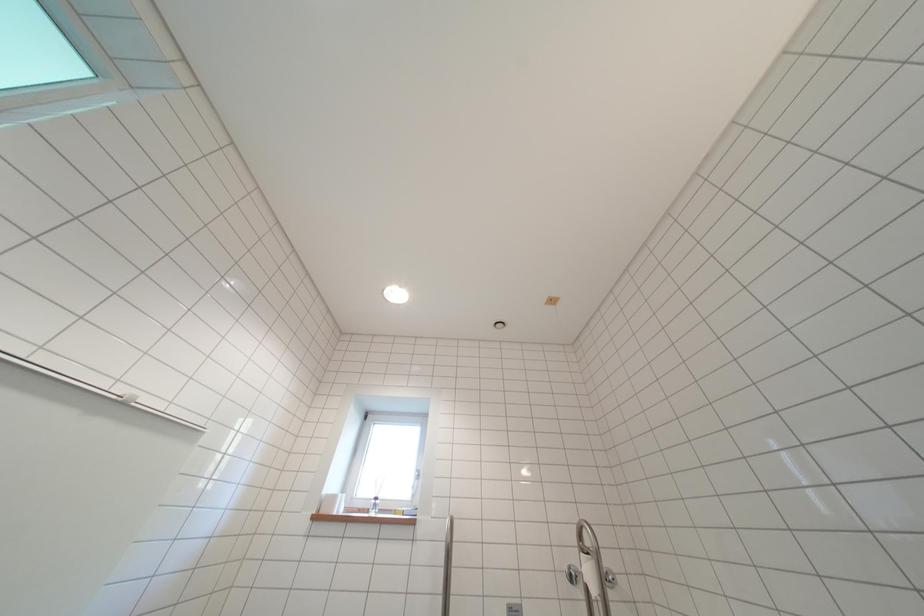
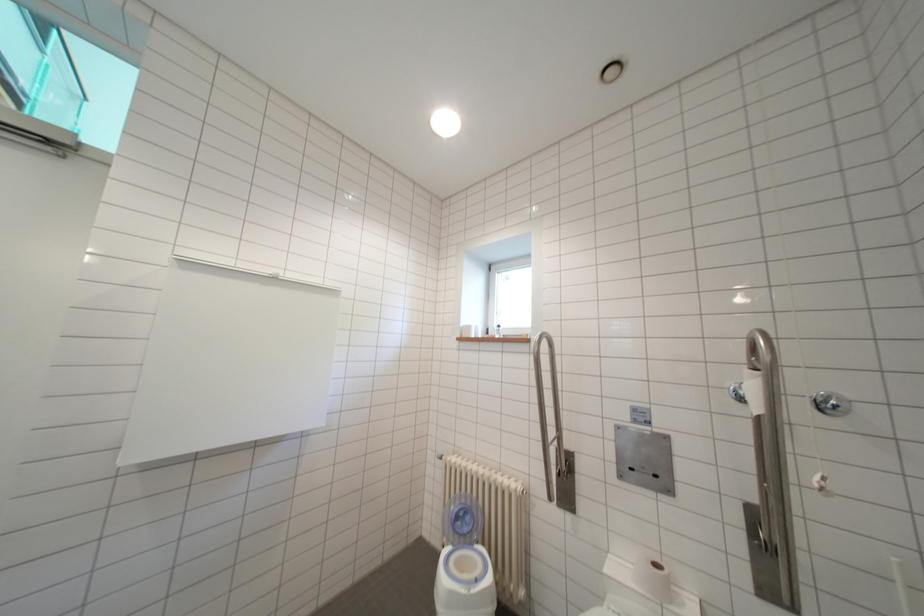
The images are taken continuously from a first-person perspective. In which direction is your viewpoint rotating?

The camera rotated toward left-down.